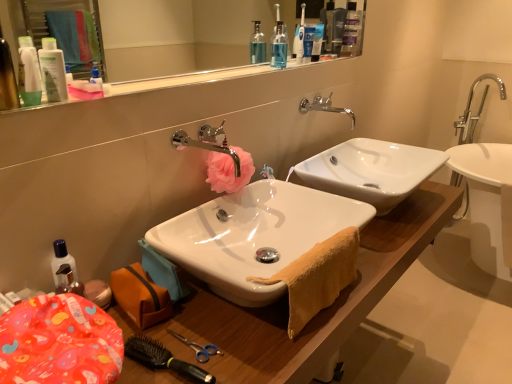
The height and width of the screenshot is (384, 512). In order to click on unoccupied space behind black plastic brush at lower left, acting as the 1th brush starting from the back in this screenshot , I will do `click(201, 312)`.